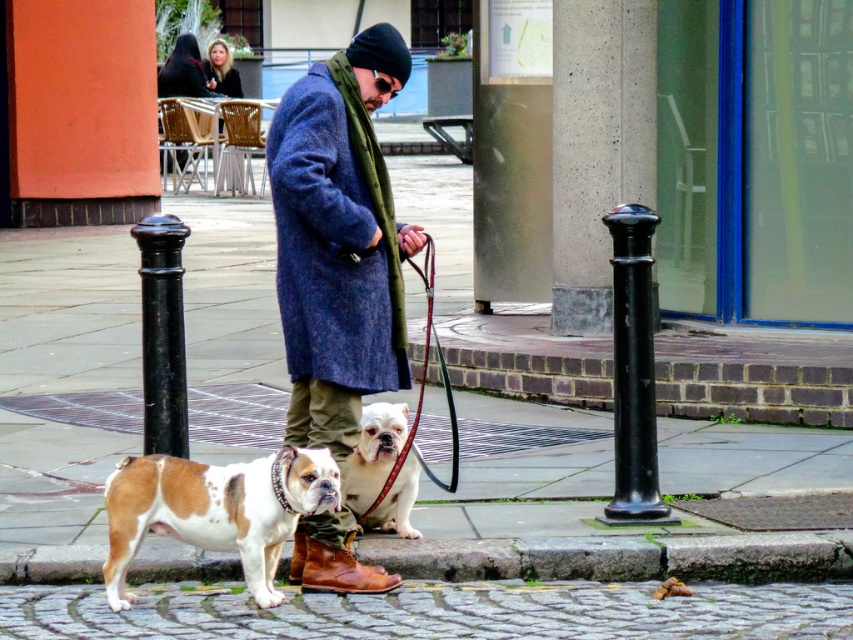
Between point (192, 637) and point (306, 454), which one is positioned behind?

Point (306, 454)

Who is higher up, cobblestone pavement at lower center or white and brown fur at center?

white and brown fur at center is above.

The height and width of the screenshot is (640, 853). Identify the location of cobblestone pavement at lower center. (436, 611).

At what (x,y) coordinates should I click in order to perform the action: click on cobblestone pavement at lower center. Please return your answer as a coordinate pair (x, y). Looking at the image, I should click on (436, 611).

Which is in front, point (154, 384) or point (419, 412)?

Point (154, 384) is in front.

Looking at this image, is black polished metal pole at center smaller than leather at lower center?

Incorrect, black polished metal pole at center is not smaller in size than leather at lower center.

Image resolution: width=853 pixels, height=640 pixels. What are the coordinates of `black polished metal pole at center` in the screenshot? It's located at (161, 333).

Can you confirm if blue wool coat at center is smaller than black matte pole at right?

No.

Who is positioned more to the left, blue wool coat at center or black matte pole at right?

From the viewer's perspective, blue wool coat at center appears more on the left side.

Is point (318, 522) closer to camera compared to point (641, 241)?

Yes, point (318, 522) is closer to viewer.

Locate an element on the screen. The width and height of the screenshot is (853, 640). blue wool coat at center is located at coordinates (339, 241).